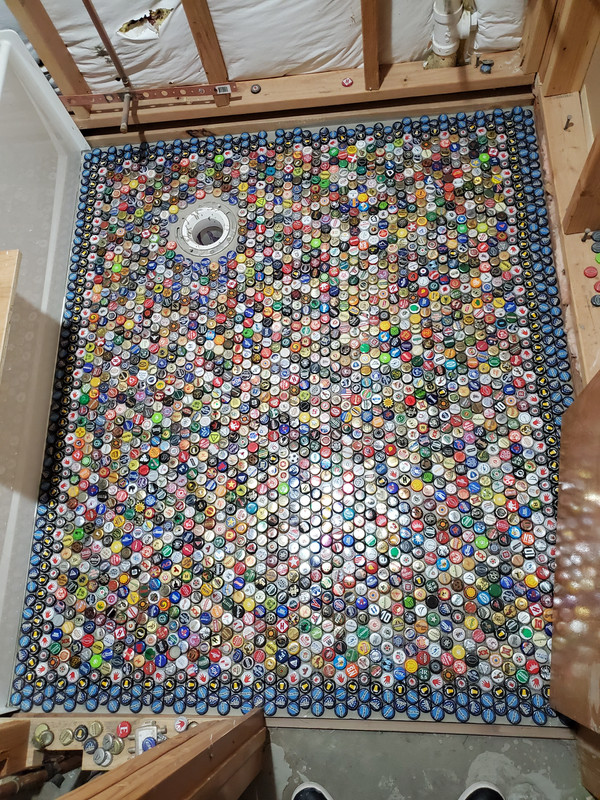
In order to click on shelf in this screenshot , I will do `click(14, 273)`.